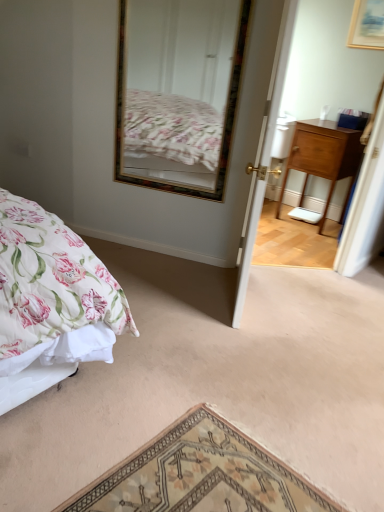
You are a GUI agent. You are given a task and a screenshot of the screen. Output one action in this format:
    pyautogui.click(x=<x>, y=<y>)
    Task: Click on the vacant area that is in front of white wooden door at center
    The height and width of the screenshot is (512, 384).
    Given the screenshot: What is the action you would take?
    [249, 344]